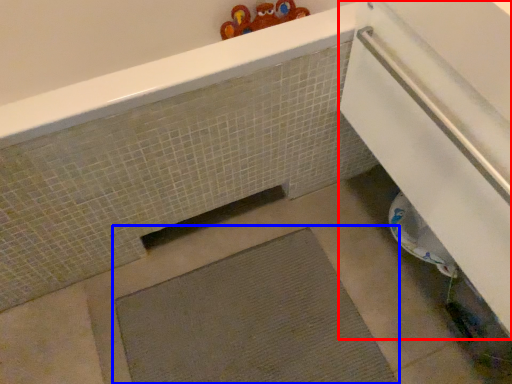
Question: Which object appears closest to the camera in this image, screen door (highlighted by a red box) or bath mat (highlighted by a blue box)?

Choices:
 (A) screen door
 (B) bath mat

Answer: (A)